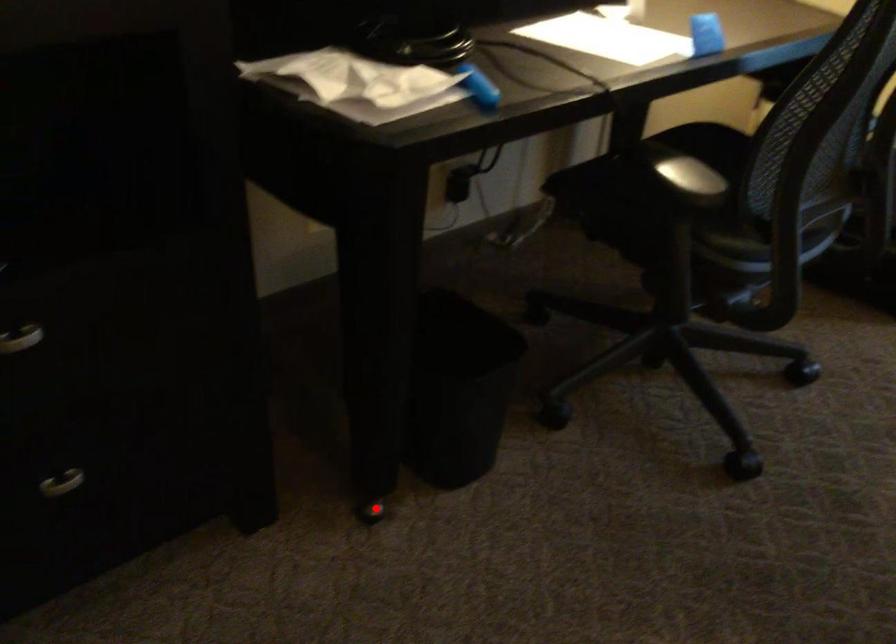
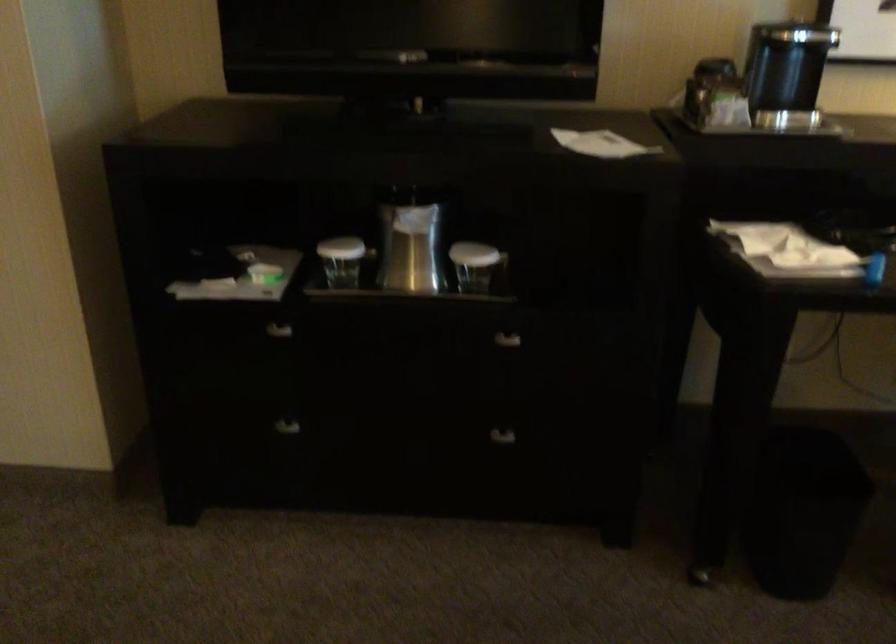
Question: I am providing you with two images of the same scene from different viewpoints. Image1 has a red point marked. In image2, the corresponding 3D location appears at what relative position? Reply with the corresponding letter.

Choices:
 (A) Closer
 (B) Farther

Answer: (B)